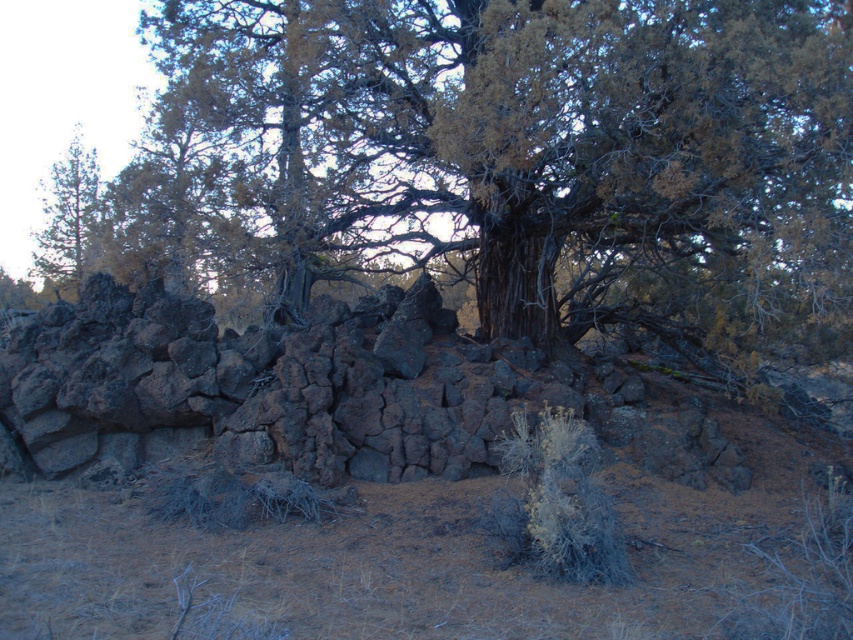
Question: Does dark brown bark tree at center appear over green pine tree at left?

Choices:
 (A) no
 (B) yes

Answer: (B)

Question: Which point is closer to the camera taking this photo?

Choices:
 (A) (321, 182)
 (B) (68, 157)

Answer: (A)

Question: Among these points, which one is farthest from the camera?

Choices:
 (A) (62, 198)
 (B) (714, 170)

Answer: (A)

Question: In this image, where is dark brown bark tree at center located relative to green pine tree at left?

Choices:
 (A) below
 (B) above

Answer: (B)

Question: Does dark brown bark tree at center appear over green pine tree at left?

Choices:
 (A) no
 (B) yes

Answer: (B)